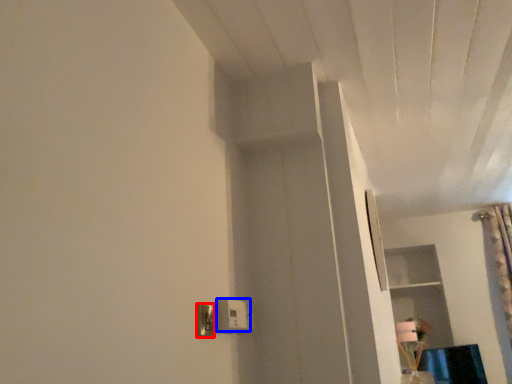
Question: Which object appears farthest to the camera in this image, light switch (highlighted by a red box) or light switch (highlighted by a blue box)?

Choices:
 (A) light switch
 (B) light switch

Answer: (B)